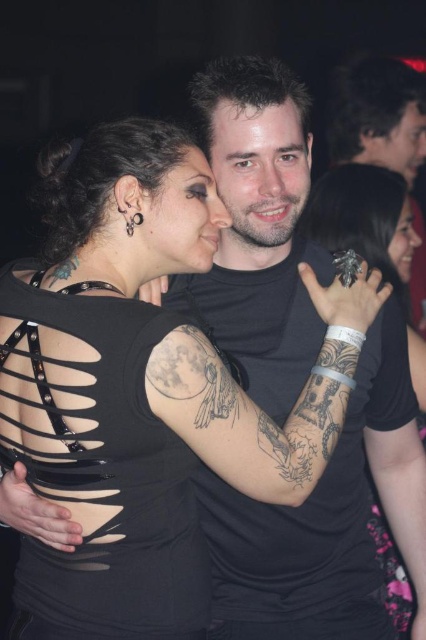
Does matte black face at center have a larger size compared to smooth skin face at upper right?

No.

Where is `matte black face at center`? matte black face at center is located at coordinates (183, 218).

The height and width of the screenshot is (640, 426). What do you see at coordinates (183, 218) in the screenshot? I see `matte black face at center` at bounding box center [183, 218].

Locate an element on the screen. matte black face at center is located at coordinates (183, 218).

Can you confirm if black matte ring at upper right is shorter than smooth skin face at center?

No.

Is point (400, 236) positioned behind point (264, 106)?

Yes, it is behind point (264, 106).

Between point (324, 221) and point (268, 124), which one is positioned in front?

Point (268, 124)

Identify the location of black matte ring at upper right. (373, 240).

Does smooth skin face at center come behind matte black hair at upper right?

No, smooth skin face at center is closer to the viewer.

This screenshot has height=640, width=426. In order to click on smooth skin face at center in this screenshot , I will do `click(259, 173)`.